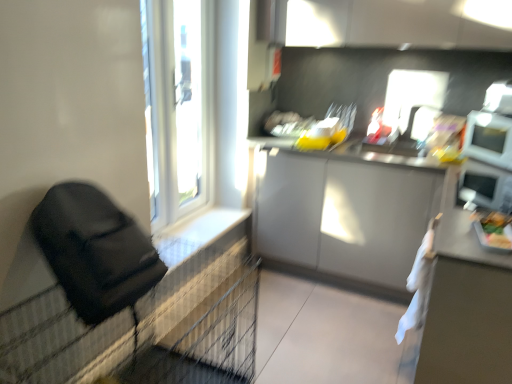
Question: Can you confirm if white plastic window at upper left is shorter than white plastic window frame at upper left?

Choices:
 (A) no
 (B) yes

Answer: (A)

Question: From a real-world perspective, does white plastic window at upper left stand above white plastic window frame at upper left?

Choices:
 (A) yes
 (B) no

Answer: (B)

Question: Is white plastic window at upper left smaller than white plastic window frame at upper left?

Choices:
 (A) yes
 (B) no

Answer: (B)

Question: From the image's perspective, is white plastic window at upper left below white plastic window frame at upper left?

Choices:
 (A) yes
 (B) no

Answer: (A)

Question: Can you confirm if white plastic window at upper left is positioned to the left of white plastic window frame at upper left?

Choices:
 (A) yes
 (B) no

Answer: (A)

Question: Relative to white textured tile at lower left, is white plastic window at upper left in front or behind?

Choices:
 (A) behind
 (B) front

Answer: (B)

Question: In terms of size, does white plastic window at upper left appear bigger or smaller than white textured tile at lower left?

Choices:
 (A) big
 (B) small

Answer: (A)

Question: Considering the positions of white plastic window at upper left and white textured tile at lower left in the image, is white plastic window at upper left wider or thinner than white textured tile at lower left?

Choices:
 (A) thin
 (B) wide

Answer: (A)

Question: Based on their positions, is white plastic window at upper left located to the left or right of white textured tile at lower left?

Choices:
 (A) right
 (B) left

Answer: (B)

Question: Is white plastic window at upper left to the left or to the right of green matte tray at right in the image?

Choices:
 (A) left
 (B) right

Answer: (A)

Question: Is point (223, 41) closer or farther from the camera than point (490, 231)?

Choices:
 (A) farther
 (B) closer

Answer: (A)

Question: In the image, is white plastic window at upper left positioned in front of or behind green matte tray at right?

Choices:
 (A) front
 (B) behind

Answer: (B)

Question: Looking at the image, does white plastic window at upper left seem bigger or smaller compared to green matte tray at right?

Choices:
 (A) big
 (B) small

Answer: (A)

Question: From the image's perspective, is green matte tray at right above or below white textured tile at lower left?

Choices:
 (A) below
 (B) above

Answer: (B)

Question: Considering the positions of green matte tray at right and white textured tile at lower left in the image, is green matte tray at right wider or thinner than white textured tile at lower left?

Choices:
 (A) thin
 (B) wide

Answer: (A)